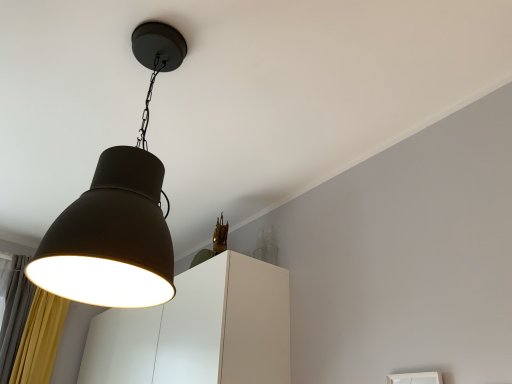
Question: From a real-world perspective, is matte black lampshade at upper left physically located above or below white matte cabinet at center?

Choices:
 (A) above
 (B) below

Answer: (A)

Question: Is matte black lampshade at upper left in front of or behind white matte cabinet at center in the image?

Choices:
 (A) front
 (B) behind

Answer: (A)

Question: Would you say matte black lampshade at upper left is inside or outside white matte cabinet at center?

Choices:
 (A) outside
 (B) inside

Answer: (A)

Question: In the image, is white matte cabinet at center on the left side or the right side of matte black lampshade at upper left?

Choices:
 (A) left
 (B) right

Answer: (A)

Question: In terms of height, does white matte cabinet at center look taller or shorter compared to matte black lampshade at upper left?

Choices:
 (A) short
 (B) tall

Answer: (A)

Question: Is white matte cabinet at center in front of or behind matte black lampshade at upper left in the image?

Choices:
 (A) front
 (B) behind

Answer: (B)

Question: Considering the positions of white matte cabinet at center and matte black lampshade at upper left in the image, is white matte cabinet at center bigger or smaller than matte black lampshade at upper left?

Choices:
 (A) small
 (B) big

Answer: (B)